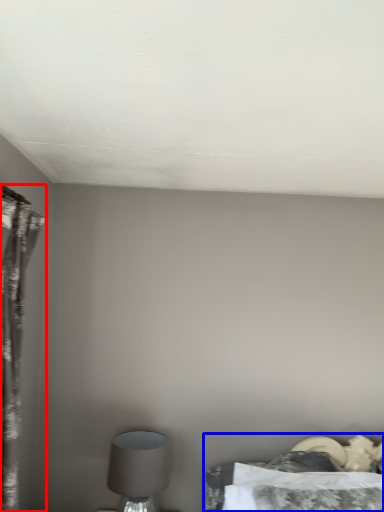
Question: Which of the following is the farthest to the observer, curtain (highlighted by a red box) or bed (highlighted by a blue box)?

Choices:
 (A) curtain
 (B) bed

Answer: (B)